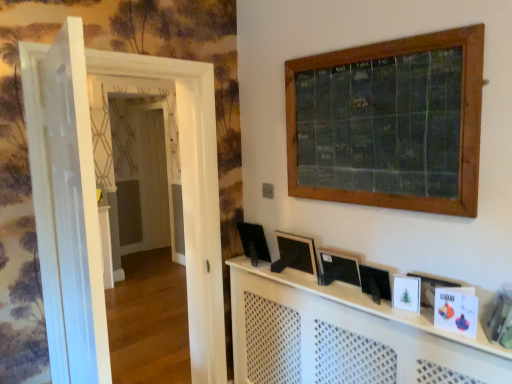
Locate an element on the screen. free location above green slate window at upper center (from a real-world perspective) is located at coordinates (370, 44).